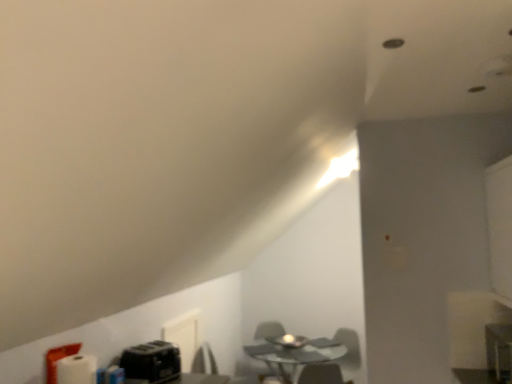
Question: Does metallic silver computer desk at lower right have a lesser height compared to transparent glass table at center?

Choices:
 (A) yes
 (B) no

Answer: (A)

Question: Is transparent glass table at center at the back of metallic silver computer desk at lower right?

Choices:
 (A) yes
 (B) no

Answer: (B)

Question: Is the surface of metallic silver computer desk at lower right in direct contact with transparent glass table at center?

Choices:
 (A) yes
 (B) no

Answer: (B)

Question: Considering the relative positions of metallic silver computer desk at lower right and transparent glass table at center in the image provided, is metallic silver computer desk at lower right to the right of transparent glass table at center from the viewer's perspective?

Choices:
 (A) yes
 (B) no

Answer: (A)

Question: Is metallic silver computer desk at lower right smaller than transparent glass table at center?

Choices:
 (A) yes
 (B) no

Answer: (A)

Question: Is metallic silver computer desk at lower right not inside transparent glass table at center?

Choices:
 (A) yes
 (B) no

Answer: (A)

Question: Is metallic silver computer desk at lower right behind black plastic toaster at lower left?

Choices:
 (A) no
 (B) yes

Answer: (A)

Question: Does metallic silver computer desk at lower right have a lesser height compared to black plastic toaster at lower left?

Choices:
 (A) no
 (B) yes

Answer: (A)

Question: Is metallic silver computer desk at lower right to the left of black plastic toaster at lower left from the viewer's perspective?

Choices:
 (A) no
 (B) yes

Answer: (A)

Question: Can you confirm if metallic silver computer desk at lower right is smaller than black plastic toaster at lower left?

Choices:
 (A) no
 (B) yes

Answer: (A)

Question: From the image's perspective, is metallic silver computer desk at lower right above black plastic toaster at lower left?

Choices:
 (A) no
 (B) yes

Answer: (B)

Question: Considering the relative sizes of metallic silver computer desk at lower right and black plastic toaster at lower left in the image provided, is metallic silver computer desk at lower right thinner than black plastic toaster at lower left?

Choices:
 (A) yes
 (B) no

Answer: (A)

Question: From a real-world perspective, does metallic silver computer desk at lower right sit lower than matte gray swivel chair at center?

Choices:
 (A) yes
 (B) no

Answer: (B)